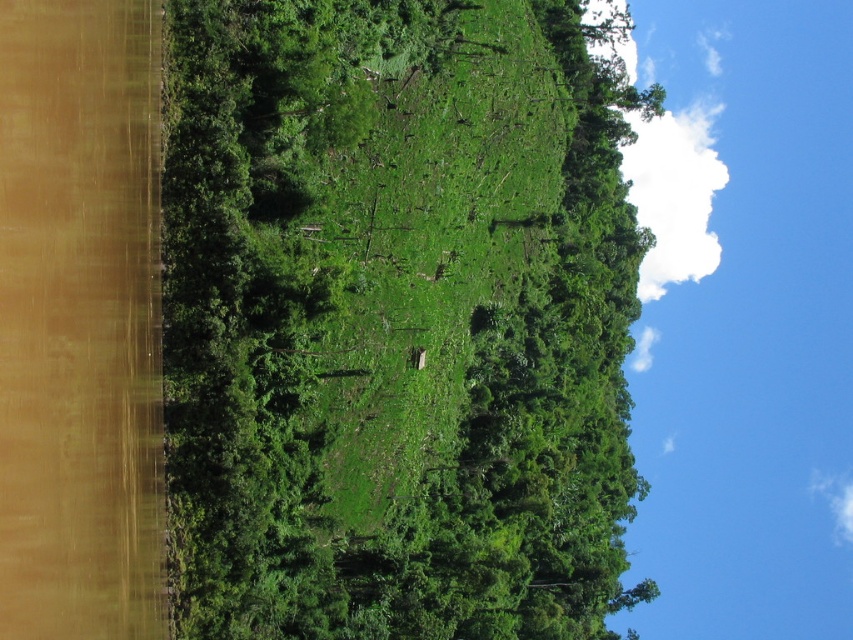
You are standing at the camera position looking at the landscape. There are two points marked in the scene, one at coordinates point (x=511, y=200) and another at point (x=376, y=349). Which point is closer to you?

Point (x=511, y=200) is further to the camera than point (x=376, y=349), so the closer point to you is point (x=376, y=349).

You are planning to set up a picnic area in the green grassy field at center. However, you need to ensure there is enough space between the green leafy tree at center and the picnic area. Based on the scene description, can you determine if the tree is wider than the field?

The green leafy tree at center might be wider than green grassy field at center, so there may not be enough space for the picnic area. It is recommended to choose a different location.